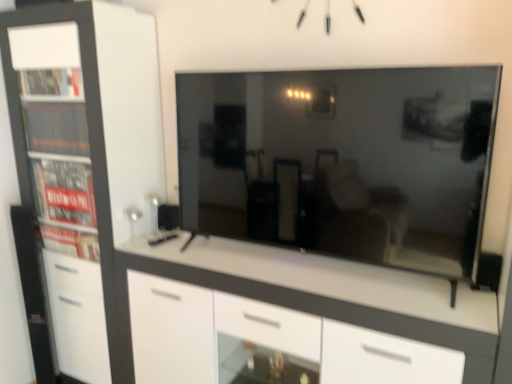
Question: Does matte black tv at center have a greater height compared to white matte cabinet at left?

Choices:
 (A) yes
 (B) no

Answer: (B)

Question: Is white matte cabinet at left surrounded by matte black tv at center?

Choices:
 (A) yes
 (B) no

Answer: (B)

Question: From a real-world perspective, does matte black tv at center stand above white matte cabinet at left?

Choices:
 (A) yes
 (B) no

Answer: (A)

Question: Is matte black tv at center at the left side of white matte cabinet at left?

Choices:
 (A) no
 (B) yes

Answer: (A)

Question: From a real-world perspective, is matte black tv at center below white matte cabinet at left?

Choices:
 (A) no
 (B) yes

Answer: (A)

Question: In the image, is white matte cabinet at left positioned in front of or behind matte black tv at center?

Choices:
 (A) front
 (B) behind

Answer: (B)

Question: From a real-world perspective, relative to matte black tv at center, is white matte cabinet at left vertically above or below?

Choices:
 (A) above
 (B) below

Answer: (B)

Question: Is white matte cabinet at left situated inside matte black tv at center or outside?

Choices:
 (A) inside
 (B) outside

Answer: (B)

Question: Would you say white matte cabinet at left is to the left or to the right of matte black tv at center in the picture?

Choices:
 (A) right
 (B) left

Answer: (B)

Question: Considering the positions of point (286, 261) and point (384, 223), is point (286, 261) closer or farther from the camera than point (384, 223)?

Choices:
 (A) closer
 (B) farther

Answer: (B)

Question: Considering the relative positions of white glossy chest of drawers at center and matte black tv at center in the image provided, is white glossy chest of drawers at center to the left or to the right of matte black tv at center?

Choices:
 (A) right
 (B) left

Answer: (B)

Question: From the image's perspective, is white glossy chest of drawers at center located above or below matte black tv at center?

Choices:
 (A) below
 (B) above

Answer: (A)

Question: From a real-world perspective, is white glossy chest of drawers at center above or below matte black tv at center?

Choices:
 (A) below
 (B) above

Answer: (A)

Question: Is matte black tv at center inside the boundaries of white glossy chest of drawers at center, or outside?

Choices:
 (A) inside
 (B) outside

Answer: (B)

Question: Relative to white glossy chest of drawers at center, is matte black tv at center in front or behind?

Choices:
 (A) front
 (B) behind

Answer: (A)